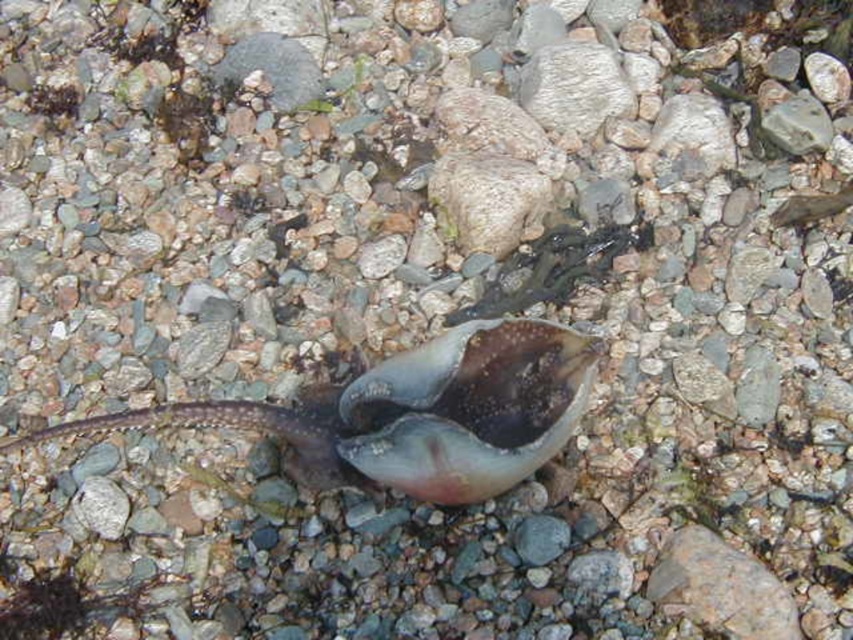
Question: Observing the image, what is the correct spatial positioning of translucent rubber snail at center in reference to smooth gray rock at center?

Choices:
 (A) above
 (B) below

Answer: (B)

Question: Does translucent rubber snail at center appear under smooth gray rock at center?

Choices:
 (A) yes
 (B) no

Answer: (A)

Question: Which point is farther to the camera?

Choices:
 (A) [x=376, y=381]
 (B) [x=270, y=36]

Answer: (B)

Question: In this image, where is translucent rubber snail at center located relative to smooth gray rock at center?

Choices:
 (A) above
 (B) below

Answer: (B)

Question: Among these objects, which one is farthest from the camera?

Choices:
 (A) smooth gray rock at center
 (B) translucent rubber snail at center

Answer: (A)